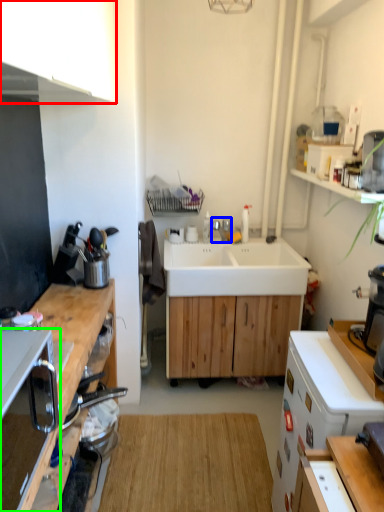
Question: Based on their relative distances, which object is farther from cabinetry (highlighted by a red box)? Choose from tap (highlighted by a blue box) and corded phone (highlighted by a green box).

Choices:
 (A) tap
 (B) corded phone

Answer: (A)